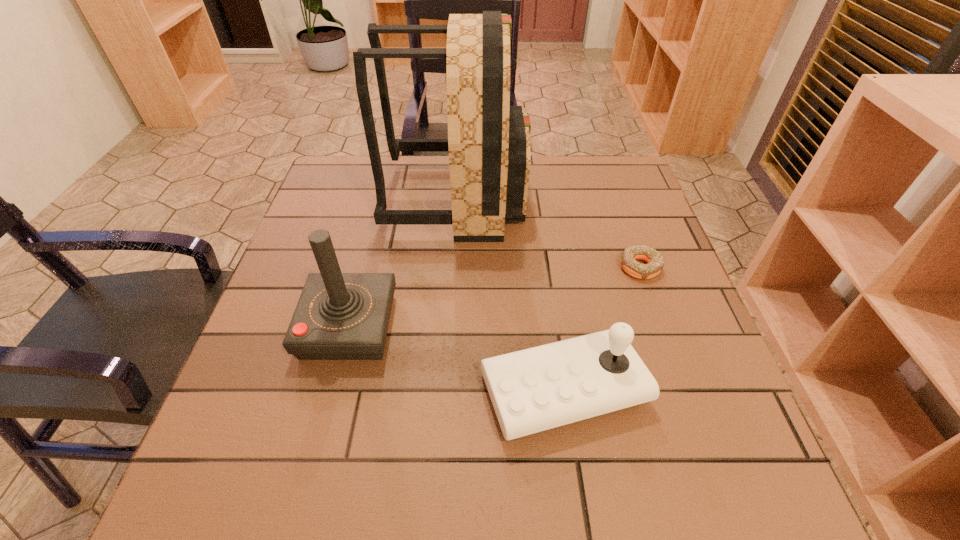
Find the location of a particular element. free space between the second shortest object and the doughnut is located at coordinates (602, 328).

At what (x,y) coordinates should I click in order to perform the action: click on vacant area that lies between the backpack and the second farthest object. Please return your answer as a coordinate pair (x, y). The width and height of the screenshot is (960, 540). Looking at the image, I should click on (548, 233).

Select which object is the second closest to the backpack. Please provide its 2D coordinates. Your answer should be formatted as a tuple, i.e. [(x, y)], where the tuple contains the x and y coordinates of a point satisfying the conditions above.

[(629, 256)]

Identify which object is located as the second nearest to the right joystick. Please provide its 2D coordinates. Your answer should be formatted as a tuple, i.e. [(x, y)], where the tuple contains the x and y coordinates of a point satisfying the conditions above.

[(339, 316)]

The height and width of the screenshot is (540, 960). Identify the location of free space that satisfies the following two spatial constraints: 1. on the front face of the third tallest object; 2. on the left side of the backpack. (444, 389).

I want to click on vacant point that satisfies the following two spatial constraints: 1. on the front face of the tallest object; 2. on the left side of the shorter joystick, so click(x=444, y=389).

Find the location of a particular element. This screenshot has width=960, height=540. vacant space that satisfies the following two spatial constraints: 1. on the front face of the doughnut; 2. on the right side of the tallest object is located at coordinates (452, 268).

Locate an element on the screen. The width and height of the screenshot is (960, 540). free space that satisfies the following two spatial constraints: 1. on the front face of the shortest object; 2. on the left side of the tallest object is located at coordinates pyautogui.click(x=452, y=268).

Identify the location of blank space that satisfies the following two spatial constraints: 1. on the front face of the backpack; 2. on the right side of the second farthest object. The width and height of the screenshot is (960, 540). (452, 268).

What are the coordinates of `blank space that satisfies the following two spatial constraints: 1. on the front face of the third tallest object; 2. on the left side of the farthest object` in the screenshot? It's located at (444, 389).